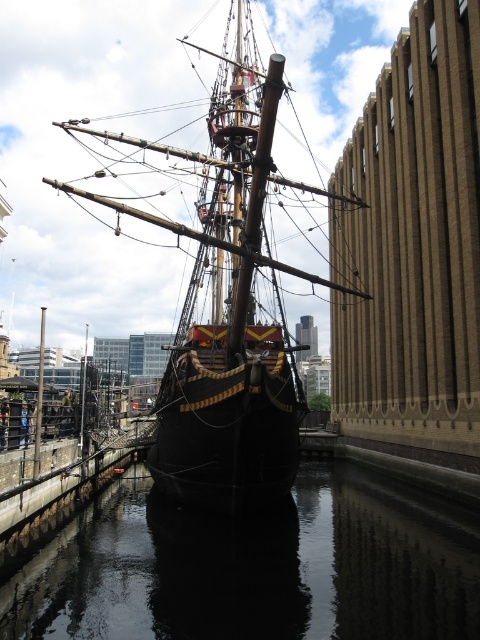
Who is positioned more to the right, dark reflective water at center or dark wood ship at center?

dark reflective water at center is more to the right.

Does dark reflective water at center have a greater height compared to dark wood ship at center?

No.

The image size is (480, 640). Identify the location of dark reflective water at center. (256, 566).